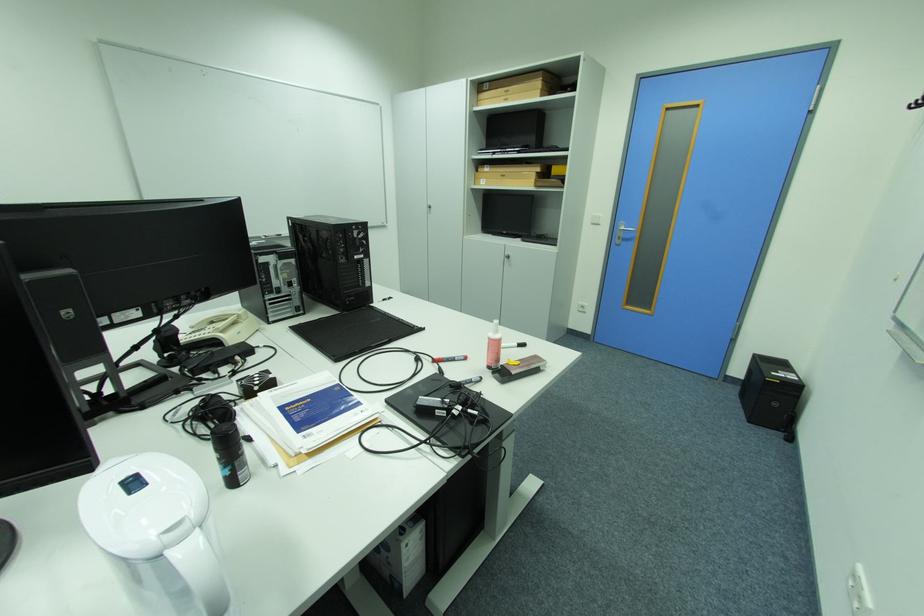
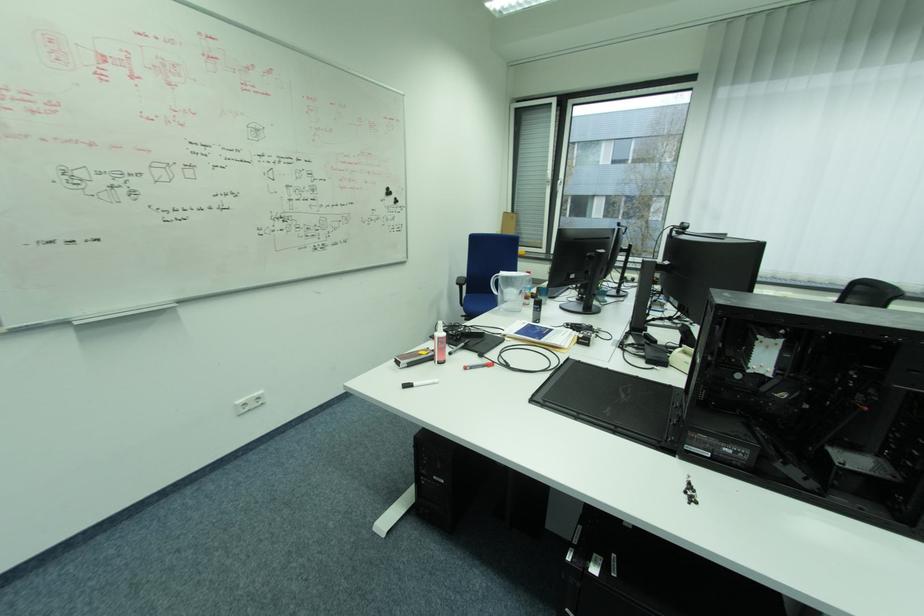
The point at [473,359] is marked in the first image. Where is the corresponding point in the second image?

(472, 369)